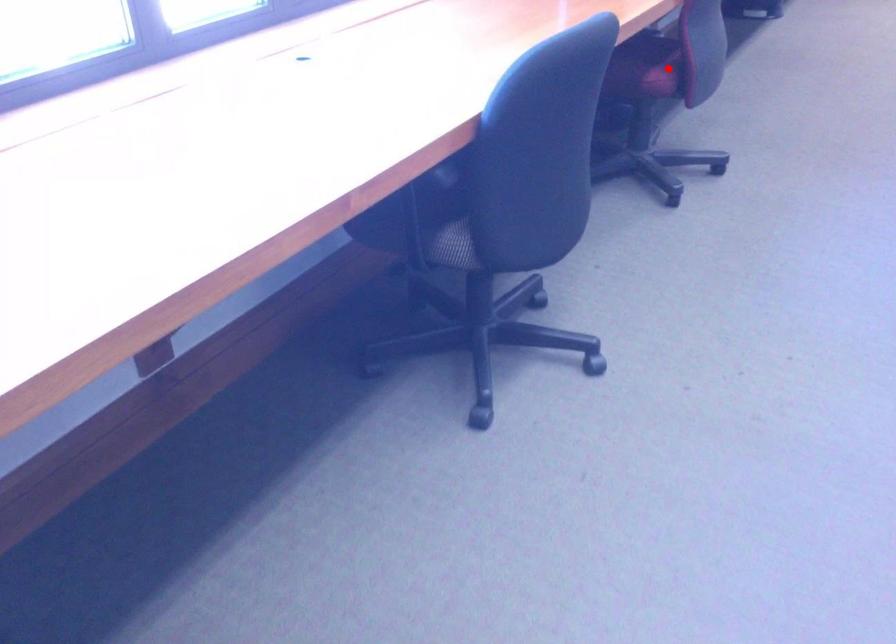
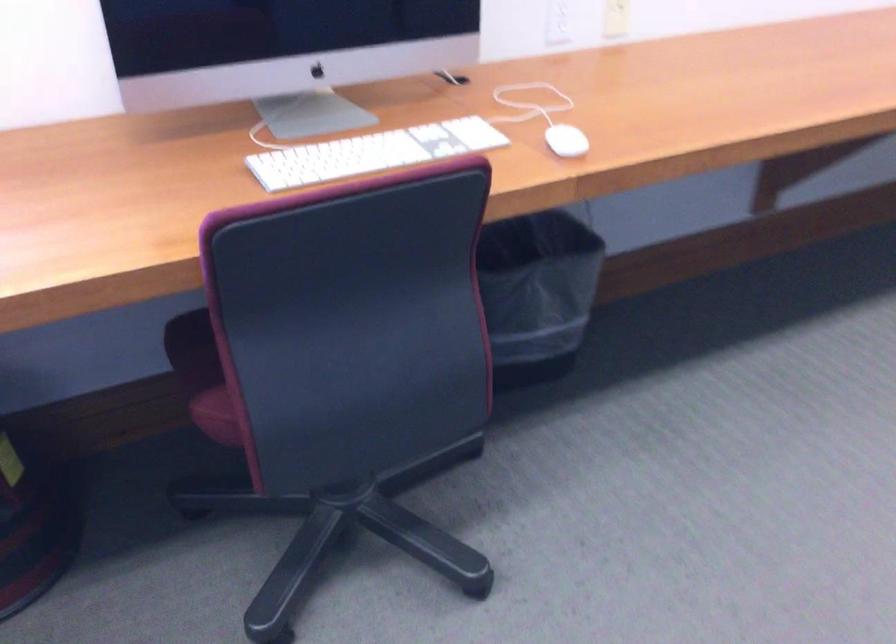
Question: I am providing you with two images of the same scene from different viewpoints. In image1, a red point is highlighted. Considering the same 3D point in image2, which of the following is correct?

Choices:
 (A) It is closer
 (B) It is farther

Answer: (A)